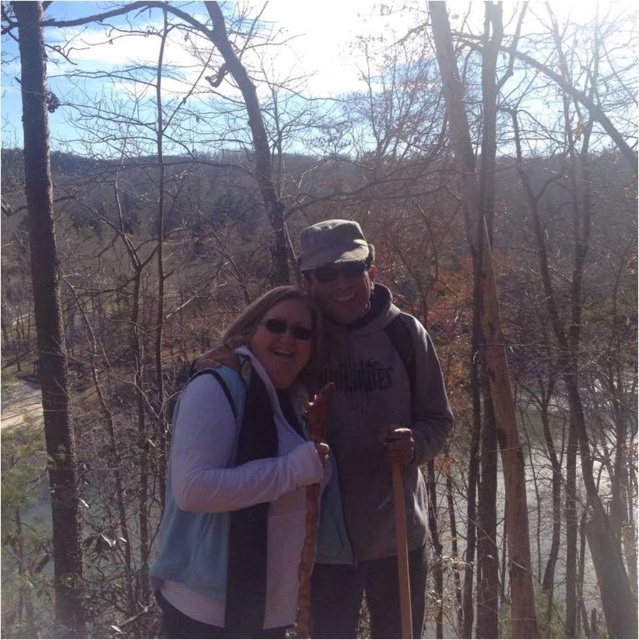
The width and height of the screenshot is (639, 640). What do you see at coordinates (240, 477) in the screenshot?
I see `blue fabric vest at center` at bounding box center [240, 477].

Is blue fabric vest at center bigger than gray matte jacket at center?

No.

The image size is (639, 640). Describe the element at coordinates (240, 477) in the screenshot. I see `blue fabric vest at center` at that location.

You are a GUI agent. You are given a task and a screenshot of the screen. Output one action in this format:
    pyautogui.click(x=<x>, y=<y>)
    Task: Click on the blue fabric vest at center
    
    Given the screenshot: What is the action you would take?
    pyautogui.click(x=240, y=477)

Which is behind, point (197, 387) or point (311, 276)?

The point (311, 276) is behind.

Find the location of a particular element. Image resolution: width=639 pixels, height=640 pixels. blue fabric vest at center is located at coordinates pos(240,477).

How distant is gray matte jacket at center from matte black goggles at center?

gray matte jacket at center is 20.51 inches from matte black goggles at center.

This screenshot has height=640, width=639. What do you see at coordinates (373, 435) in the screenshot?
I see `gray matte jacket at center` at bounding box center [373, 435].

Is point (327, 262) farther from camera compared to point (309, 282)?

No, (327, 262) is in front of (309, 282).

You are a GUI agent. You are given a task and a screenshot of the screen. Output one action in this format:
    pyautogui.click(x=<x>, y=<y>)
    Task: Click on the gray matte jacket at center
    Image resolution: width=639 pixels, height=640 pixels.
    Given the screenshot: What is the action you would take?
    pyautogui.click(x=373, y=435)